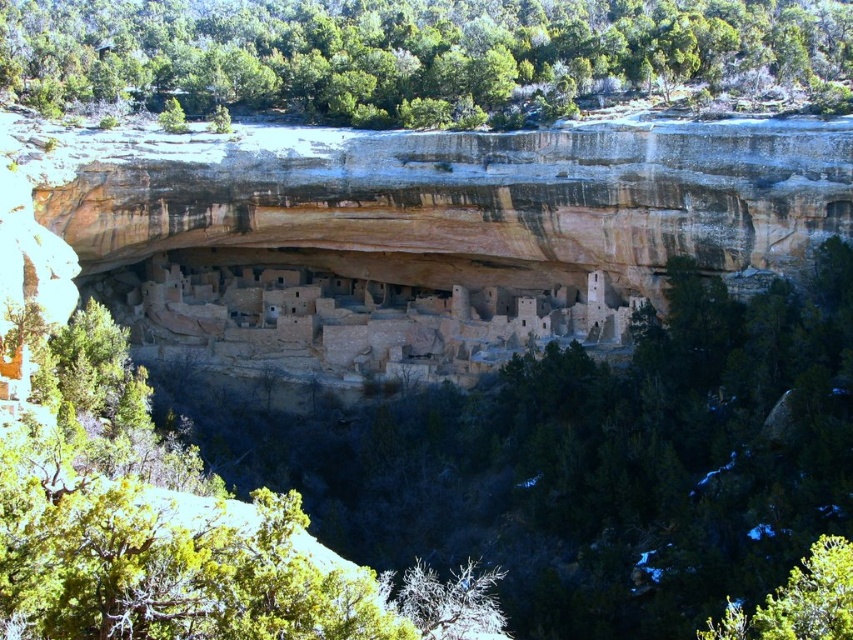
Question: Is green leafy tree at upper center further to camera compared to green leafy tree at lower right?

Choices:
 (A) no
 (B) yes

Answer: (B)

Question: Can you confirm if green leafy tree at upper center is wider than green leafy tree at lower right?

Choices:
 (A) yes
 (B) no

Answer: (A)

Question: Among these objects, which one is nearest to the camera?

Choices:
 (A) green leafy tree at upper center
 (B) green leafy tree at lower right

Answer: (B)

Question: Is green leafy tree at upper center bigger than green leafy tree at lower right?

Choices:
 (A) no
 (B) yes

Answer: (B)

Question: Which point appears closest to the camera in this image?

Choices:
 (A) (850, 568)
 (B) (761, 36)

Answer: (A)

Question: Which point appears closest to the camera in this image?

Choices:
 (A) (7, 56)
 (B) (836, 572)

Answer: (B)